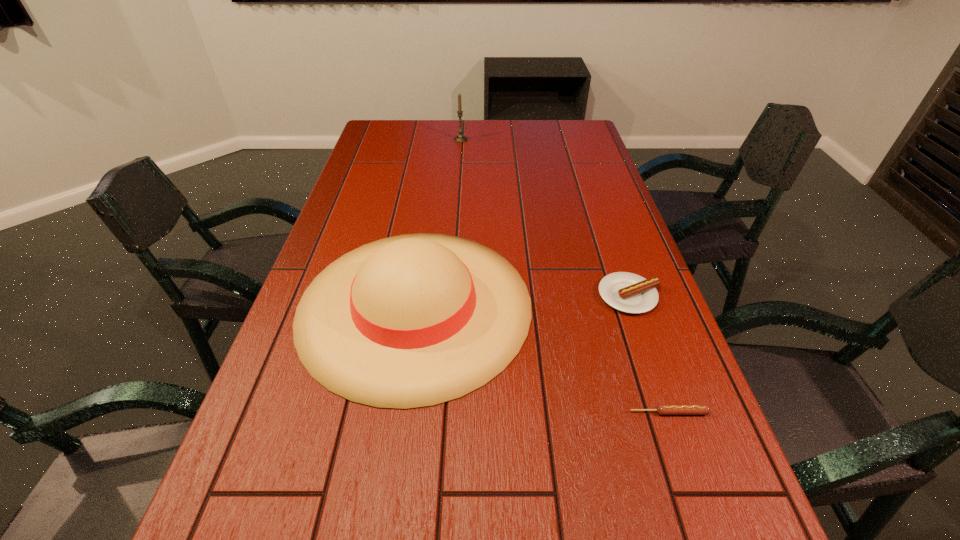
At what (x,y) coordinates should I click in order to perform the action: click on object present at the far edge. Please return your answer as a coordinate pair (x, y). Image resolution: width=960 pixels, height=540 pixels. Looking at the image, I should click on (460, 138).

Identify the location of object situated at the left edge. Image resolution: width=960 pixels, height=540 pixels. (414, 320).

At what (x,y) coordinates should I click in order to perform the action: click on free space at the far edge of the desktop. Please return your answer as a coordinate pair (x, y). Looking at the image, I should click on (453, 124).

Locate an element on the screen. free space at the left edge is located at coordinates (232, 475).

You are a GUI agent. You are given a task and a screenshot of the screen. Output one action in this format:
    pyautogui.click(x=<x>, y=<y>)
    Task: Click on the vacant area at the right edge
    
    Given the screenshot: What is the action you would take?
    (644, 274)

Image resolution: width=960 pixels, height=540 pixels. Identify the location of vacant space that's between the taller sausage and the shorter sausage. (649, 354).

Find the location of a particular element. This screenshot has height=540, width=960. free space that is in between the nearer sausage and the candle is located at coordinates (564, 276).

This screenshot has width=960, height=540. What are the coordinates of `vacant region between the farther sausage and the candle` in the screenshot? It's located at (545, 218).

Find the location of `vacant point located between the sombrero and the candle`. vacant point located between the sombrero and the candle is located at coordinates (438, 222).

What are the coordinates of `vacant region between the nearer sausage and the farther sausage` in the screenshot? It's located at (649, 354).